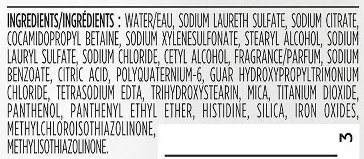
Where is `"fragrance/parfum"`? "fragrance/parfum" is located at coordinates (251, 58), (307, 57).